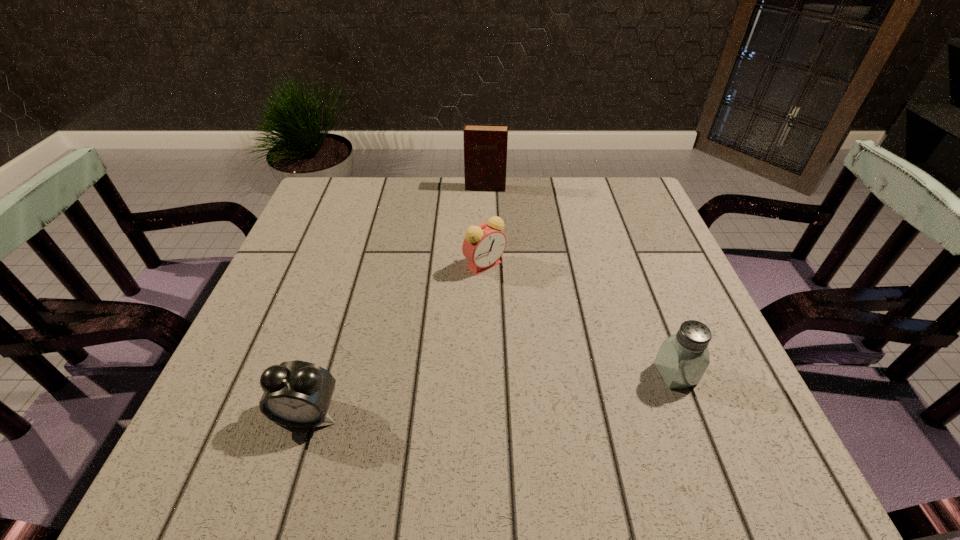
This screenshot has width=960, height=540. I want to click on the left alarm clock, so click(x=297, y=394).

Locate an element on the screen. The height and width of the screenshot is (540, 960). the leftmost object is located at coordinates (297, 394).

This screenshot has height=540, width=960. I want to click on the rightmost object, so click(x=683, y=358).

This screenshot has width=960, height=540. In order to click on saltshaker in this screenshot , I will do [x=683, y=358].

At what (x,y) coordinates should I click in order to perform the action: click on the farther alarm clock. Please return your answer as a coordinate pair (x, y). Looking at the image, I should click on (x=484, y=244).

Locate an element on the screen. This screenshot has width=960, height=540. the third nearest object is located at coordinates (484, 244).

Identify the location of the farthest object. This screenshot has width=960, height=540. (485, 145).

This screenshot has width=960, height=540. In order to click on the tallest object in this screenshot , I will do `click(485, 145)`.

Find the location of a particular element. This screenshot has height=540, width=960. vacant space positioned on the left of the rightmost object is located at coordinates click(624, 374).

Find the location of a particular element. vacant space located on the face of the right alarm clock is located at coordinates (476, 395).